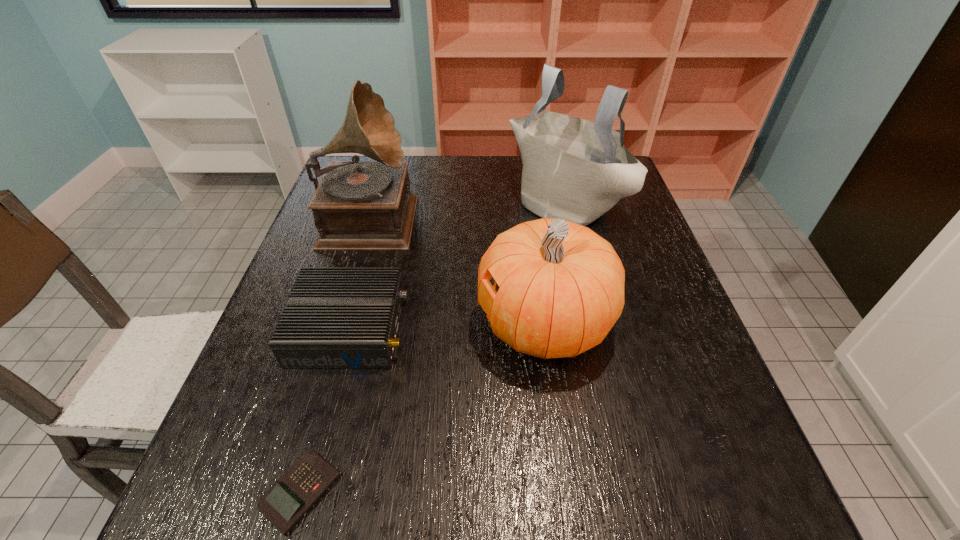
Where is `vacant space located on the front-facing side of the third tallest object`? vacant space located on the front-facing side of the third tallest object is located at coordinates pyautogui.click(x=432, y=323).

Where is `vacant space positioned on the back panel of the router`? The height and width of the screenshot is (540, 960). vacant space positioned on the back panel of the router is located at coordinates (491, 327).

I want to click on vacant space located 0.190m on the back of the calculator, so click(x=338, y=359).

Where is `record player at the far edge`? record player at the far edge is located at coordinates (358, 205).

The image size is (960, 540). Identify the location of shopping bag that is positioned at the far edge. pos(573,169).

You are a GUI agent. You are given a task and a screenshot of the screen. Output one action in this format:
    pyautogui.click(x=<x>, y=<y>)
    Task: Click on the object that is positioned at the near edge
    
    Given the screenshot: What is the action you would take?
    pyautogui.click(x=298, y=489)

Identify the location of record player that is at the left edge. (358, 205).

Locate an element on the screen. This screenshot has width=960, height=540. router that is at the left edge is located at coordinates (336, 317).

I want to click on calculator that is at the left edge, so click(x=298, y=489).

Locate an element on the screen. The height and width of the screenshot is (540, 960). object at the right edge is located at coordinates (573, 169).